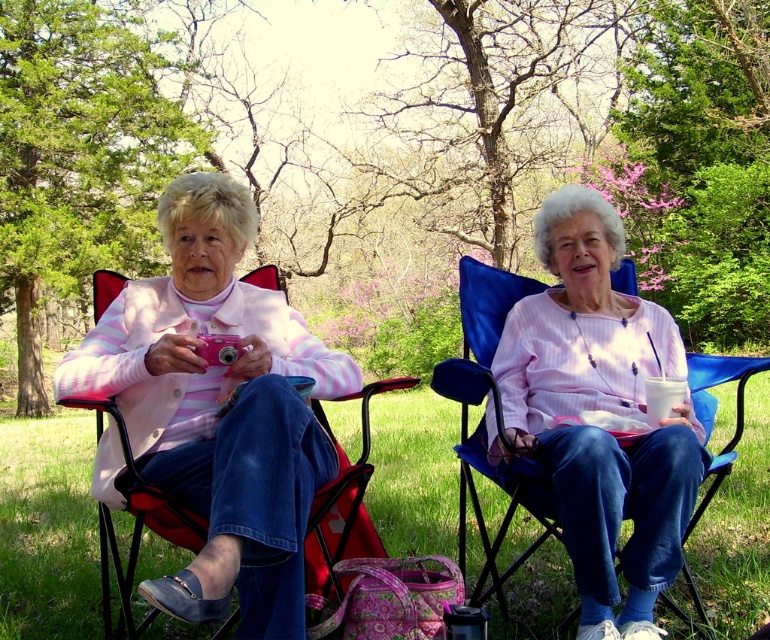
Question: Which of the following is the closest to the observer?

Choices:
 (A) pink striped sweater at center
 (B) pink striped shirt at center
 (C) pink matte camera at left

Answer: (A)

Question: Is pink matte camera at left to the right of pink striped shirt at center from the viewer's perspective?

Choices:
 (A) yes
 (B) no

Answer: (B)

Question: In this image, where is pink striped sweater at center located relative to pink striped shirt at center?

Choices:
 (A) below
 (B) above

Answer: (B)

Question: Among these objects, which one is farthest from the camera?

Choices:
 (A) pink striped shirt at center
 (B) pink striped sweater at center

Answer: (A)

Question: In this image, where is pink striped sweater at center located relative to pink striped shirt at center?

Choices:
 (A) above
 (B) below

Answer: (A)

Question: Among these objects, which one is nearest to the camera?

Choices:
 (A) pink striped shirt at center
 (B) pink matte camera at left

Answer: (B)